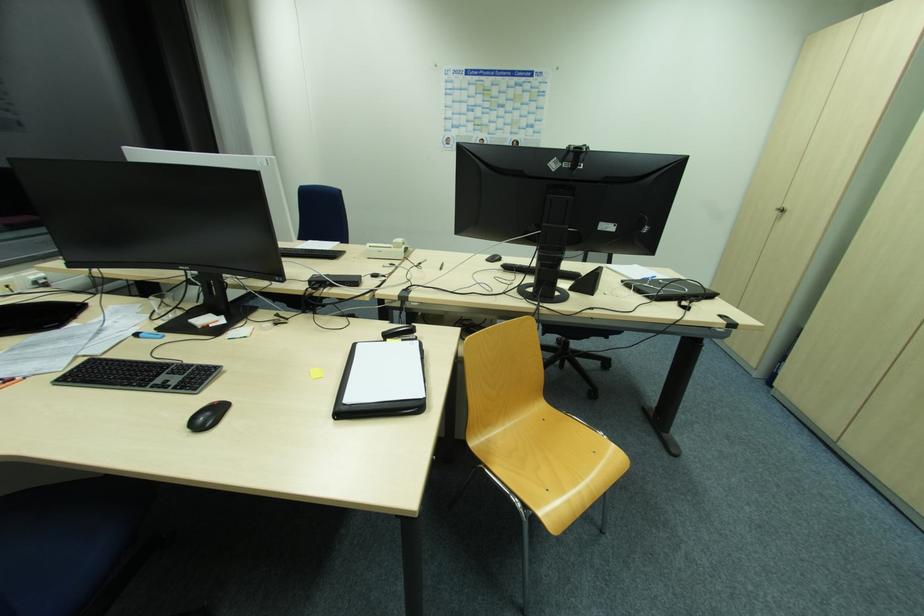
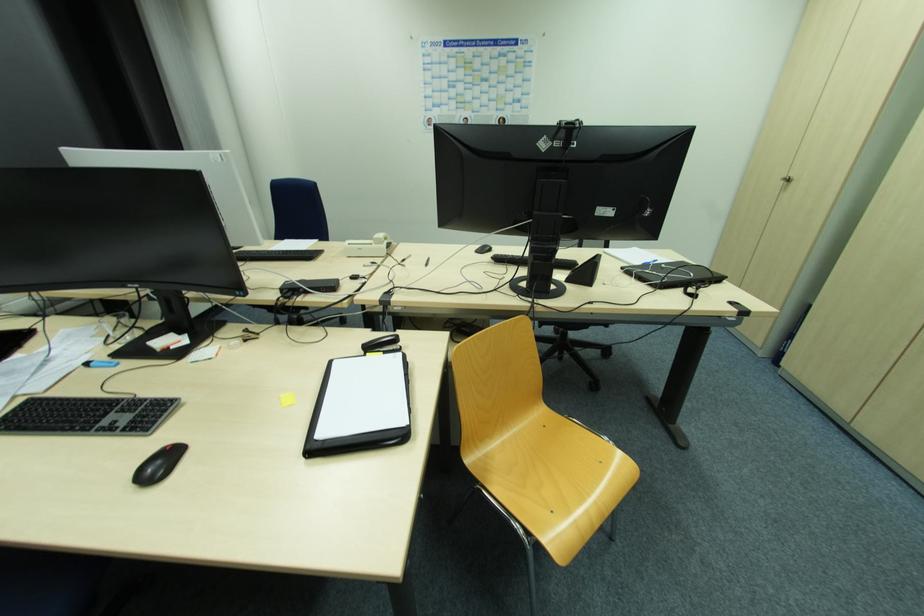
Locate, in the second image, the point that corresponds to (x=387, y=342) in the first image.

(368, 357)